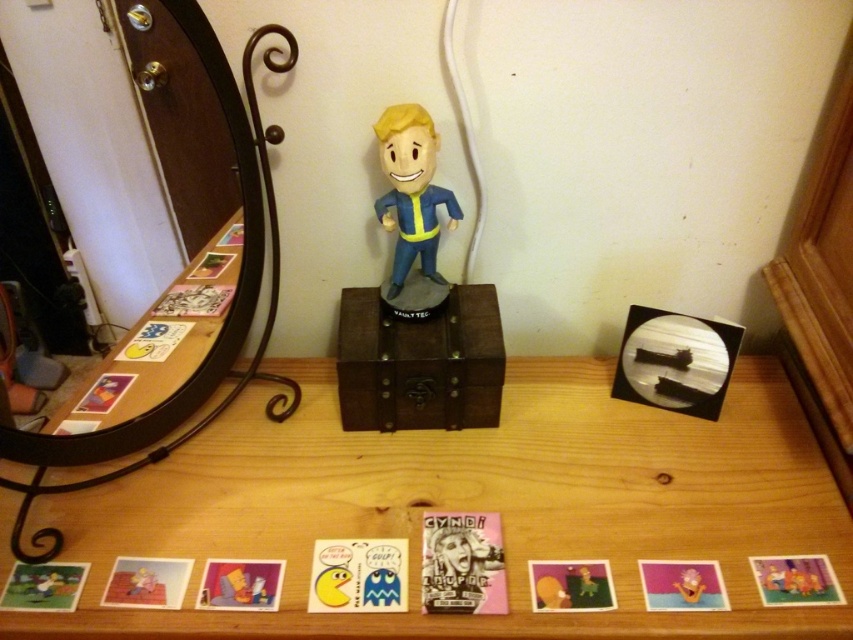
You are standing in front of the wooden table at center and the brown wooden chest at center. Which object is closer to you?

The wooden table at center is closer to you than the brown wooden chest at center.

You are organizing items on a wooden table at center and a black glass mirror at left. Since you want to place a new decorative item that requires more space, which surface would be more suitable?

The wooden table at center is larger in size than the black glass mirror at left, so it would be more suitable for placing the new decorative item that requires more space.